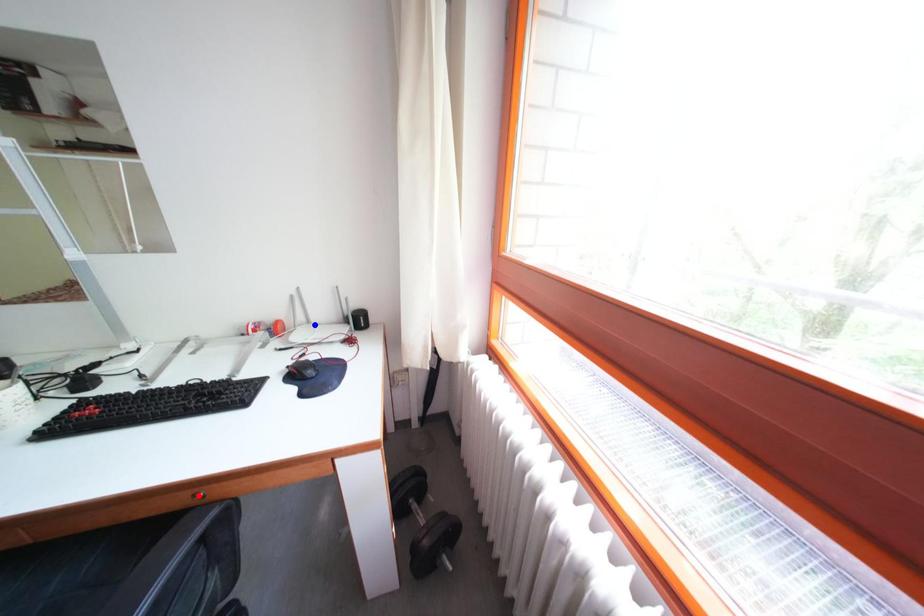
Question: Two points are marked on the image. Which point is closer to the camera?

Choices:
 (A) Blue point is closer.
 (B) Red point is closer.

Answer: (B)